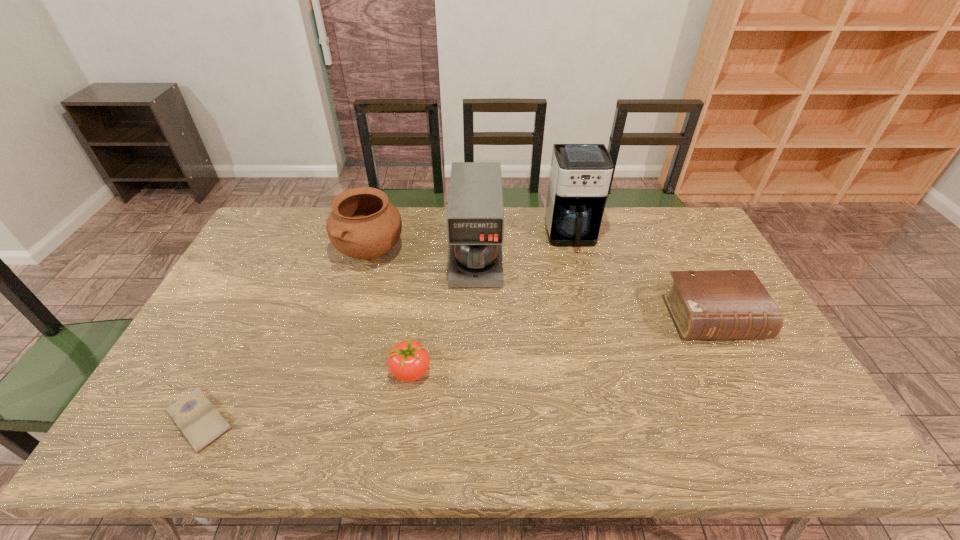
Where is `object at the left edge`? The width and height of the screenshot is (960, 540). object at the left edge is located at coordinates (201, 423).

Image resolution: width=960 pixels, height=540 pixels. I want to click on object at the right edge, so click(x=722, y=304).

Locate an element on the screen. object situated at the near left corner is located at coordinates (201, 423).

In the image, there is a desktop. Where is `free space at the far edge`? This screenshot has height=540, width=960. free space at the far edge is located at coordinates (306, 226).

This screenshot has width=960, height=540. What are the coordinates of `vacant region at the near edge of the desktop` in the screenshot? It's located at (289, 432).

In the image, there is a desktop. At what (x,y) coordinates should I click in order to perform the action: click on vacant space at the left edge. Please return your answer as a coordinate pair (x, y). The height and width of the screenshot is (540, 960). Looking at the image, I should click on (276, 275).

Find the location of a particular element. Image resolution: width=960 pixels, height=540 pixels. vacant area at the right edge of the desktop is located at coordinates (764, 390).

In the image, there is a desktop. Where is `vacant space at the far right corner`? vacant space at the far right corner is located at coordinates (697, 221).

The width and height of the screenshot is (960, 540). Identify the location of free point between the Bible and the fifth object from left to right. (642, 277).

The height and width of the screenshot is (540, 960). In order to click on free space between the left coffee maker and the tallest object in this screenshot , I will do `click(524, 246)`.